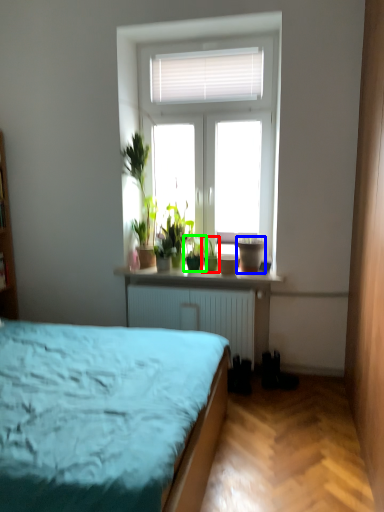
Question: Which object is positioned closest to houseplant (highlighted by a red box)? Select from flowerpot (highlighted by a blue box) and houseplant (highlighted by a green box).

Choices:
 (A) flowerpot
 (B) houseplant

Answer: (B)